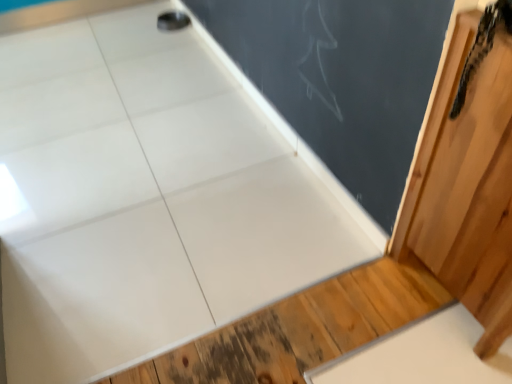
The height and width of the screenshot is (384, 512). In order to click on vacant point to the left of wooden barn door at right in this screenshot , I will do `click(359, 319)`.